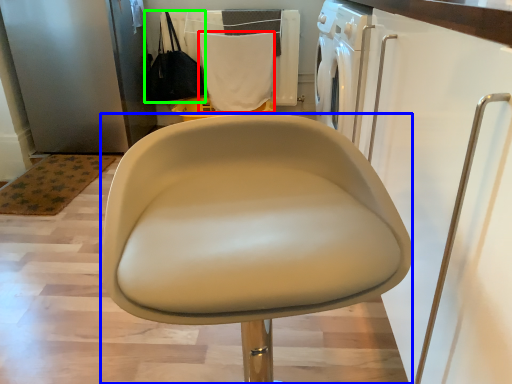
Question: Which object is positioned farthest from cloth (highlighted by a red box)? Select from chair (highlighted by a blue box) and handbag (highlighted by a green box).

Choices:
 (A) chair
 (B) handbag

Answer: (A)